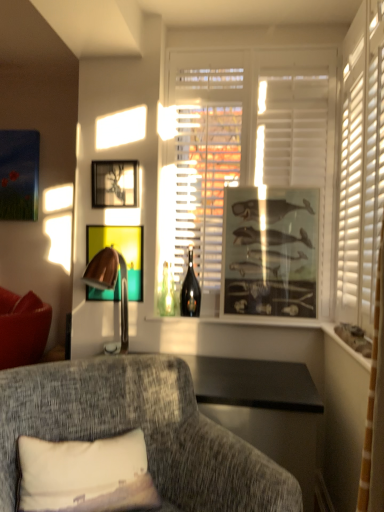
You are a GUI agent. You are given a task and a screenshot of the screen. Output one action in this format:
    pyautogui.click(x=<x>, y=<y>)
    Task: Click on the vacant area on top of clear glass bottles at center, which is the 1th window sill from back to front (from a real-world perspective)
    This screenshot has width=384, height=512.
    Given the screenshot: What is the action you would take?
    pyautogui.click(x=239, y=315)